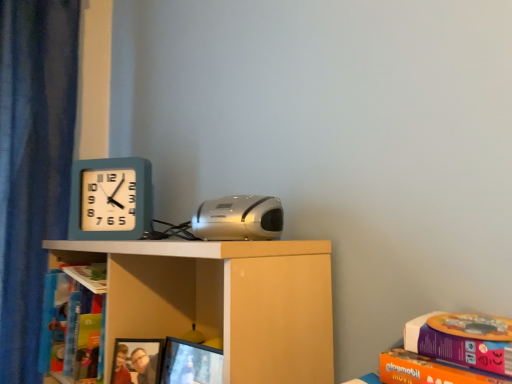
I want to click on silver metallic stereo at center, so click(239, 218).

What do you see at coordinates (136, 361) in the screenshot? The width and height of the screenshot is (512, 384). I see `matte plastic picture frame at lower center` at bounding box center [136, 361].

The width and height of the screenshot is (512, 384). In order to click on teal plastic wall clock at upper left in this screenshot , I will do `click(111, 199)`.

The height and width of the screenshot is (384, 512). Find the location of `white matte shelf at center`. white matte shelf at center is located at coordinates (222, 300).

What do you see at coordinates (222, 300) in the screenshot? The height and width of the screenshot is (384, 512). I see `white matte shelf at center` at bounding box center [222, 300].

At what (x,y) coordinates should I click in order to perform the action: click on matte black monitor at lower center. Please return your answer as a coordinate pair (x, y). Looking at the image, I should click on (190, 363).

Is hardcover book at left, which is the second book from bottom to top, aimed at blue cardboard book at left, the second book positioned from the top?

No, hardcover book at left, which is the second book from bottom to top, is not aimed at blue cardboard book at left, the second book positioned from the top.

Looking at this image, who is taller, hardcover book at left, which is the second book from bottom to top, or blue cardboard book at left, acting as the 2th book starting from the front?

Standing taller between the two is blue cardboard book at left, acting as the 2th book starting from the front.

Which of these two, hardcover book at left, the first book from the front, or blue cardboard book at left, the 1th book in the left-to-right sequence, is bigger?

With larger size is hardcover book at left, the first book from the front.

Does matte black monitor at lower center have a smaller size compared to white matte shelf at center?

Correct, matte black monitor at lower center occupies less space than white matte shelf at center.

Who is taller, matte black monitor at lower center or white matte shelf at center?

With more height is white matte shelf at center.

Looking at this image, does matte black monitor at lower center appear on the right side of white matte shelf at center?

Yes, matte black monitor at lower center is to the right of white matte shelf at center.

Based on the photo, is matte black monitor at lower center oriented away from white matte shelf at center?

Yes, matte black monitor at lower center's orientation is away from white matte shelf at center.

Does silver metallic stereo at center appear on the left side of hardcover book at left, which ranks as the 1th book in top-to-bottom order?

In fact, silver metallic stereo at center is to the right of hardcover book at left, which ranks as the 1th book in top-to-bottom order.

Is silver metallic stereo at center oriented away from hardcover book at left, the second book in the left-to-right sequence?

That's not correct — silver metallic stereo at center is not looking away from hardcover book at left, the second book in the left-to-right sequence.

Measure the distance between silver metallic stereo at center and hardcover book at left, the first book from the front.

A distance of 17.05 inches exists between silver metallic stereo at center and hardcover book at left, the first book from the front.

How different are the orientations of silver metallic stereo at center and teal plastic wall clock at upper left in degrees?

silver metallic stereo at center and teal plastic wall clock at upper left are facing 4.7 degrees away from each other.

Is silver metallic stereo at center wider than teal plastic wall clock at upper left?

Yes.

Can you confirm if silver metallic stereo at center is smaller than teal plastic wall clock at upper left?

No, silver metallic stereo at center is not smaller than teal plastic wall clock at upper left.

Find the location of a particular element. This screenshot has width=512, height=384. stereo below the teal plastic wall clock at upper left (from the image's perspective) is located at coordinates (239, 218).

Can we say hardcover book at left, which ranks as the 1th book in top-to-bottom order, lies outside teal plastic wall clock at upper left?

Absolutely, hardcover book at left, which ranks as the 1th book in top-to-bottom order, is external to teal plastic wall clock at upper left.

How many degrees apart are the facing directions of hardcover book at left, the second book in the left-to-right sequence, and teal plastic wall clock at upper left?

31.6 degrees.

From a real-world perspective, who is located higher, hardcover book at left, which ranks as the 1th book in top-to-bottom order, or teal plastic wall clock at upper left?

teal plastic wall clock at upper left is physically above.

From the image's perspective, would you say hardcover book at left, which is the second book from bottom to top, is shown under teal plastic wall clock at upper left?

Yes, from the image's perspective, hardcover book at left, which is the second book from bottom to top, is beneath teal plastic wall clock at upper left.

Are white matte shelf at center and matte black monitor at lower center located far from each other?

white matte shelf at center is actually quite close to matte black monitor at lower center.

Is white matte shelf at center wider than matte black monitor at lower center?

Yes.

Does white matte shelf at center contain matte black monitor at lower center?

Absolutely, matte black monitor at lower center is inside white matte shelf at center.

Is matte black monitor at lower center at the back of white matte shelf at center?

That's right, white matte shelf at center is facing away from matte black monitor at lower center.

Identify the location of stereo located on the right of matte plastic picture frame at lower center. This screenshot has width=512, height=384. (239, 218).

From the image's perspective, is matte plastic picture frame at lower center on top of silver metallic stereo at center?

No, from the image's perspective, matte plastic picture frame at lower center is not over silver metallic stereo at center.

Is matte plastic picture frame at lower center next to silver metallic stereo at center and touching it?

matte plastic picture frame at lower center is not next to silver metallic stereo at center, and they're not touching.

How many degrees apart are the facing directions of matte plastic picture frame at lower center and silver metallic stereo at center?

16 degrees.

Locate an element on the screen. book that appears behind the hardcover book at left, the second book in the left-to-right sequence is located at coordinates (63, 319).

Where is `shelf above the matte black monitor at lower center (from a real-world perspective)`? The height and width of the screenshot is (384, 512). shelf above the matte black monitor at lower center (from a real-world perspective) is located at coordinates (222, 300).

Estimate the real-world distances between objects in this image. Which object is further from matte black monitor at lower center, hardcover book at left, the second book in the left-to-right sequence, or teal plastic wall clock at upper left?

teal plastic wall clock at upper left.

When comparing their distances from teal plastic wall clock at upper left, does hardcover book at left, which ranks as the 1th book in top-to-bottom order, or matte plastic picture frame at lower center seem closer?

Among the two, hardcover book at left, which ranks as the 1th book in top-to-bottom order, is located nearer to teal plastic wall clock at upper left.

Which object lies further to the anchor point white matte shelf at center, teal plastic wall clock at upper left or matte plastic picture frame at lower center?

The object further to white matte shelf at center is teal plastic wall clock at upper left.

Which object lies further to the anchor point hardcover book at left, which ranks as the 1th book in top-to-bottom order, blue cardboard book at left, arranged as the second book when viewed from the right, or teal plastic wall clock at upper left?

Based on the image, teal plastic wall clock at upper left appears to be further to hardcover book at left, which ranks as the 1th book in top-to-bottom order.

Looking at the image, which one is located closer to teal plastic wall clock at upper left, silver metallic stereo at center or blue cardboard book at left, the 1th book in the left-to-right sequence?

blue cardboard book at left, the 1th book in the left-to-right sequence.

Considering their positions, is teal plastic wall clock at upper left positioned further to hardcover book at left, which appears as the 1th book when viewed from the right, than matte plastic picture frame at lower center?

teal plastic wall clock at upper left is positioned further to the anchor hardcover book at left, which appears as the 1th book when viewed from the right.

Considering their positions, is matte plastic picture frame at lower center positioned closer to teal plastic wall clock at upper left than hardcover book at left, the second book in the left-to-right sequence?

hardcover book at left, the second book in the left-to-right sequence, is closer to teal plastic wall clock at upper left.

Considering their positions, is white matte shelf at center positioned closer to matte plastic picture frame at lower center than teal plastic wall clock at upper left?

The object closer to matte plastic picture frame at lower center is white matte shelf at center.

Find the location of a particular element. This screenshot has width=512, height=384. picture frame between hardcover book at left, the first book from the front, and silver metallic stereo at center, in the horizontal direction is located at coordinates (136, 361).

The image size is (512, 384). Find the location of `picture frame situated between hardcover book at left, which is the second book from bottom to top, and matte black monitor at lower center from left to right`. picture frame situated between hardcover book at left, which is the second book from bottom to top, and matte black monitor at lower center from left to right is located at coordinates (136, 361).

Where is `computer screen between white matte shelf at center and teal plastic wall clock at upper left from front to back`? Image resolution: width=512 pixels, height=384 pixels. computer screen between white matte shelf at center and teal plastic wall clock at upper left from front to back is located at coordinates (190, 363).

Image resolution: width=512 pixels, height=384 pixels. Find the location of `book between silver metallic stereo at center and teal plastic wall clock at upper left in the front-back direction`. book between silver metallic stereo at center and teal plastic wall clock at upper left in the front-back direction is located at coordinates (85, 278).